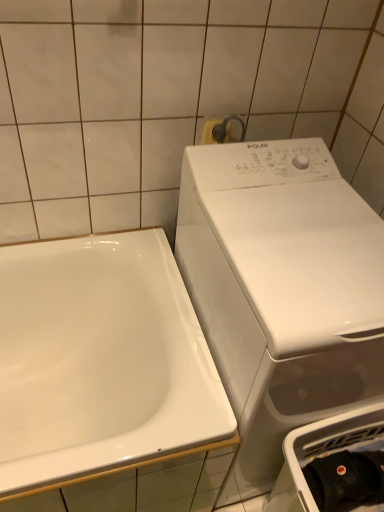
Where is `metallic silver towel bar at upper center`? metallic silver towel bar at upper center is located at coordinates (216, 132).

At what (x,y) coordinates should I click in order to perform the action: click on white plastic dish washer at lower right. Please return your answer as a coordinate pair (x, y). Looking at the image, I should click on (322, 453).

Measure the distance between point (x=165, y=441) and camera.

Point (x=165, y=441) is 35.20 inches away from camera.

Find the location of a particular element. metallic silver towel bar at upper center is located at coordinates (216, 132).

Is white glossy sink at left looking in the opposite direction of metallic silver towel bar at upper center?

white glossy sink at left does not have its back to metallic silver towel bar at upper center.

Does point (58, 362) come in front of point (230, 123)?

No, (58, 362) is further to viewer.

Which is in front, white glossy sink at left or metallic silver towel bar at upper center?

white glossy sink at left is closer to the camera.

Identify the location of towel bar behind the white glossy sink at left. This screenshot has height=512, width=384. (216, 132).

How different are the orientations of white glossy washing machine at right and white glossy sink at left in degrees?

The angular difference between white glossy washing machine at right and white glossy sink at left is 0.706 degrees.

At what (x,y) coordinates should I click in order to perform the action: click on sink that is on the left side of white glossy washing machine at right. Please return your answer as a coordinate pair (x, y). The height and width of the screenshot is (512, 384). Looking at the image, I should click on (x=100, y=362).

From their relative heights in the image, would you say white glossy washing machine at right is taller or shorter than white glossy sink at left?

In the image, white glossy washing machine at right appears to be taller than white glossy sink at left.

From the image's perspective, is white glossy washing machine at right located above white glossy sink at left?

Indeed, from the image's perspective, white glossy washing machine at right is shown above white glossy sink at left.

Do you think black cotton cap at lower right is within white plastic dish washer at lower right, or outside of it?

black cotton cap at lower right exists entirely within white plastic dish washer at lower right.

Between black cotton cap at lower right and white plastic dish washer at lower right, which one appears on the right side from the viewer's perspective?

black cotton cap at lower right is more to the right.

In terms of width, does black cotton cap at lower right look wider or thinner when compared to white plastic dish washer at lower right?

Clearly, black cotton cap at lower right has less width compared to white plastic dish washer at lower right.

From the picture: Considering the relative sizes of black cotton cap at lower right and white plastic dish washer at lower right in the image provided, is black cotton cap at lower right bigger than white plastic dish washer at lower right?

Incorrect, black cotton cap at lower right is not larger than white plastic dish washer at lower right.

Considering the positions of point (304, 493) and point (208, 136), is point (304, 493) closer or farther from the camera than point (208, 136)?

Point (304, 493) appears to be closer to the viewer than point (208, 136).

What's the angular difference between white plastic dish washer at lower right and metallic silver towel bar at upper center's facing directions?

white plastic dish washer at lower right and metallic silver towel bar at upper center are facing 90 degrees away from each other.

Could you measure the distance between white plastic dish washer at lower right and metallic silver towel bar at upper center?

white plastic dish washer at lower right and metallic silver towel bar at upper center are 33.68 inches apart from each other.

Which is more to the left, white plastic dish washer at lower right or metallic silver towel bar at upper center?

Positioned to the left is metallic silver towel bar at upper center.

Find the location of a particular element. towel bar that is above the black cotton cap at lower right (from a real-world perspective) is located at coordinates (216, 132).

Considering the relative sizes of metallic silver towel bar at upper center and black cotton cap at lower right in the image provided, is metallic silver towel bar at upper center smaller than black cotton cap at lower right?

Yes, metallic silver towel bar at upper center is smaller than black cotton cap at lower right.

Is black cotton cap at lower right at the back of metallic silver towel bar at upper center?

No, metallic silver towel bar at upper center's orientation is not away from black cotton cap at lower right.

Considering the sizes of objects metallic silver towel bar at upper center and black cotton cap at lower right in the image provided, who is taller, metallic silver towel bar at upper center or black cotton cap at lower right?

black cotton cap at lower right.

Which is more to the left, white plastic dish washer at lower right or black cotton cap at lower right?

From the viewer's perspective, white plastic dish washer at lower right appears more on the left side.

How different are the orientations of white plastic dish washer at lower right and black cotton cap at lower right in degrees?

white plastic dish washer at lower right and black cotton cap at lower right are facing 12.9 degrees away from each other.

Does white plastic dish washer at lower right have a lesser width compared to black cotton cap at lower right?

In fact, white plastic dish washer at lower right might be wider than black cotton cap at lower right.

Is white plastic dish washer at lower right outside of black cotton cap at lower right?

Yes.

From the image's perspective, which object appears higher, white glossy sink at left or white glossy washing machine at right?

white glossy washing machine at right appears higher in the image.

Considering the sizes of objects white glossy sink at left and white glossy washing machine at right in the image provided, who is wider, white glossy sink at left or white glossy washing machine at right?

white glossy sink at left.

Based on the photo, from a real-world perspective, which object rests below the other?

From a 3D spatial view, white glossy sink at left is below.

Where is `towel bar above the white glossy sink at left (from the image's perspective)`? The height and width of the screenshot is (512, 384). towel bar above the white glossy sink at left (from the image's perspective) is located at coordinates (216, 132).

The image size is (384, 512). Find the location of `sink on the left of the white glossy washing machine at right`. sink on the left of the white glossy washing machine at right is located at coordinates (100, 362).

Based on their spatial positions, is black cotton cap at lower right or metallic silver towel bar at upper center further from white glossy sink at left?

The object further to white glossy sink at left is metallic silver towel bar at upper center.

Looking at this image, based on their spatial positions, is white glossy sink at left or white plastic dish washer at lower right further from black cotton cap at lower right?

white glossy sink at left is further to black cotton cap at lower right.

Looking at the image, which one is located further to white plastic dish washer at lower right, black cotton cap at lower right or white glossy washing machine at right?

white glossy washing machine at right is further to white plastic dish washer at lower right.

Looking at this image, from the image, which object appears to be nearer to white glossy sink at left, metallic silver towel bar at upper center or white glossy washing machine at right?

The object closer to white glossy sink at left is white glossy washing machine at right.

Considering their positions, is black cotton cap at lower right positioned closer to white glossy washing machine at right than white glossy sink at left?

Based on the image, white glossy sink at left appears to be nearer to white glossy washing machine at right.

When comparing their distances from metallic silver towel bar at upper center, does white glossy washing machine at right or black cotton cap at lower right seem further?

black cotton cap at lower right lies further to metallic silver towel bar at upper center than the other object.

Estimate the real-world distances between objects in this image. Which object is closer to white glossy sink at left, metallic silver towel bar at upper center or black cotton cap at lower right?

black cotton cap at lower right is positioned closer to the anchor white glossy sink at left.

When comparing their distances from black cotton cap at lower right, does metallic silver towel bar at upper center or white plastic dish washer at lower right seem further?

Among the two, metallic silver towel bar at upper center is located further to black cotton cap at lower right.

Find the location of a particular element. This screenshot has height=512, width=384. dish washer between white glossy sink at left and black cotton cap at lower right is located at coordinates (322, 453).

Image resolution: width=384 pixels, height=512 pixels. I want to click on washing machine between metallic silver towel bar at upper center and white plastic dish washer at lower right from top to bottom, so pos(281,291).

Image resolution: width=384 pixels, height=512 pixels. Identify the location of sink between metallic silver towel bar at upper center and black cotton cap at lower right from top to bottom. (100, 362).

What are the coordinates of `washing machine between white glossy sink at left and white plastic dish washer at lower right` in the screenshot? It's located at (281, 291).